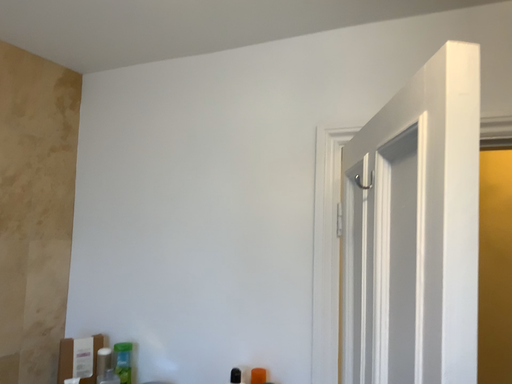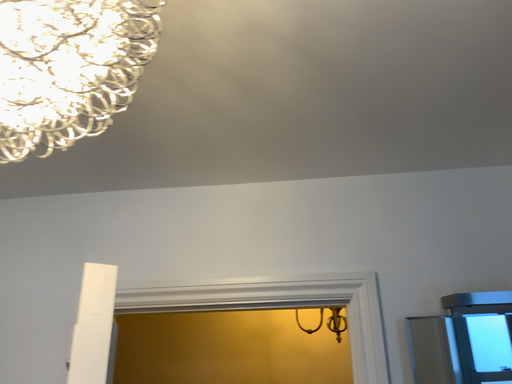
Question: Which way did the camera rotate in the video?

Choices:
 (A) rotated left
 (B) rotated right

Answer: (B)